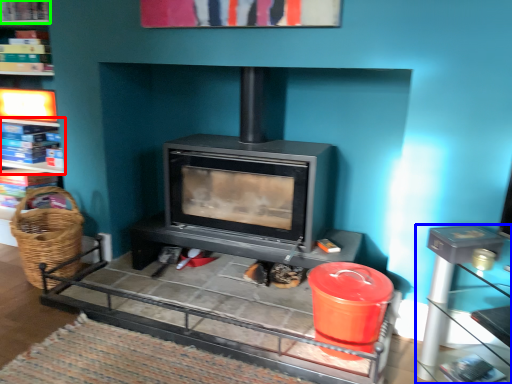
Question: Which is farther away from shelf (highlighted by a red box)? table (highlighted by a blue box) or shelf (highlighted by a green box)?

Choices:
 (A) table
 (B) shelf

Answer: (A)